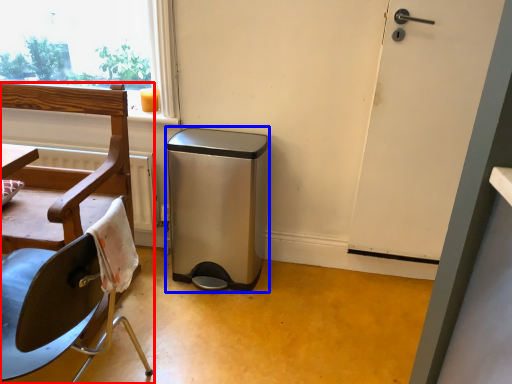
Question: Which object is further to the camera taking this photo, chair (highlighted by a red box) or dish washer (highlighted by a blue box)?

Choices:
 (A) chair
 (B) dish washer

Answer: (B)